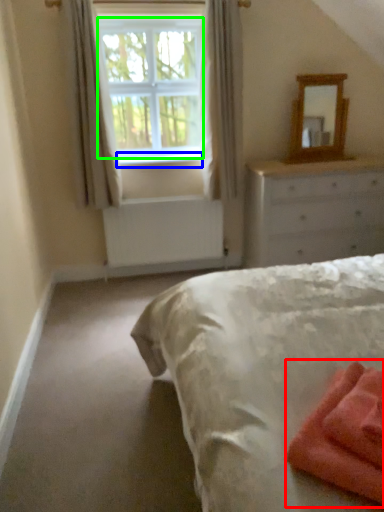
Question: Which is nearer to the material (highlighted by a red box)? window sill (highlighted by a blue box) or window screen (highlighted by a green box).

Choices:
 (A) window sill
 (B) window screen

Answer: (A)